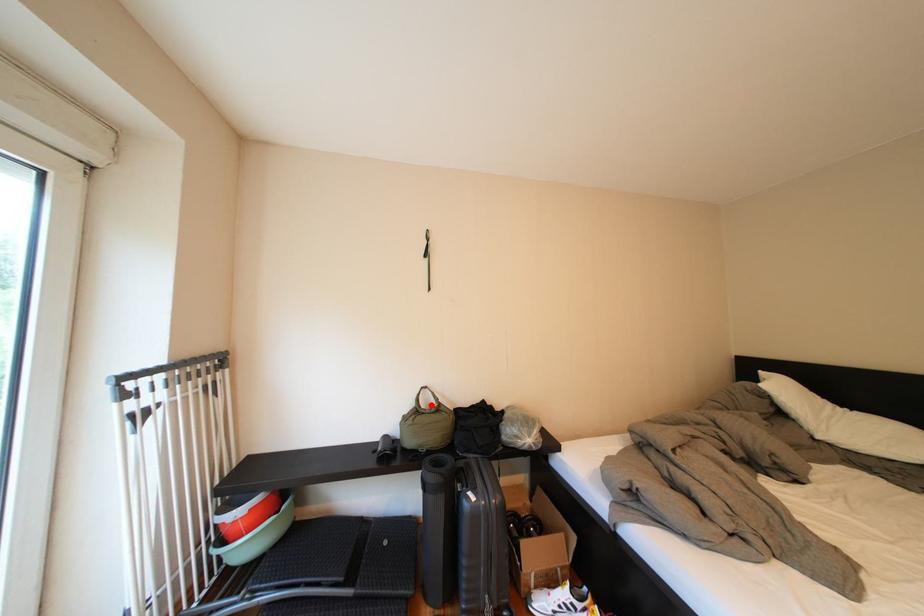
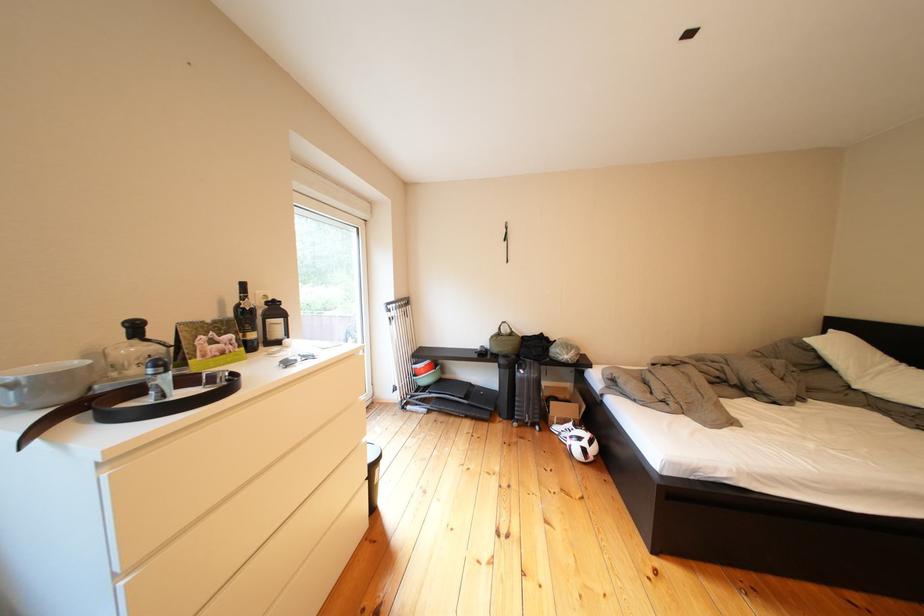
Locate, in the second image, the point that corresponds to the highlighted location in the first image.

(514, 334)